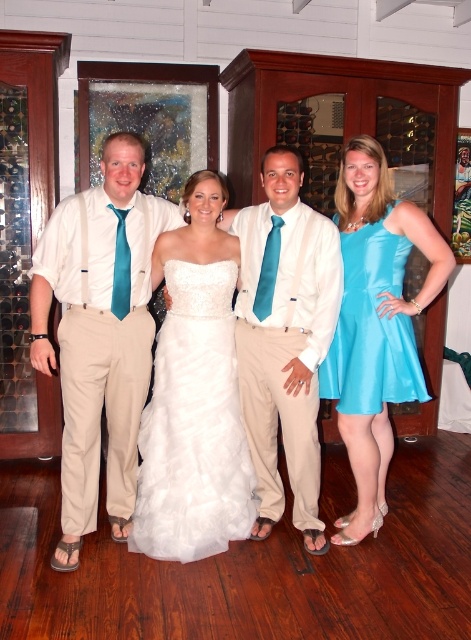
Question: Which of the following is the farthest from the observer?

Choices:
 (A) (402, 346)
 (B) (126, 241)
 (C) (262, 253)

Answer: (C)

Question: Can you confirm if matte khaki pants at left is bigger than white satin dress at center?

Choices:
 (A) no
 (B) yes

Answer: (B)

Question: Which is farther from the matte white shirt at center?

Choices:
 (A) turquoise satin dress at center
 (B) teal satin tie at center
 (C) teal satin tie at left

Answer: (C)

Question: Is teal satin tie at left bigger than teal satin tie at center?

Choices:
 (A) no
 (B) yes

Answer: (A)

Question: Which is farther from the teal satin tie at left?

Choices:
 (A) matte khaki pants at left
 (B) matte white shirt at center
 (C) turquoise satin dress at right

Answer: (C)

Question: Can you confirm if matte white shirt at center is bigger than teal satin tie at center?

Choices:
 (A) yes
 (B) no

Answer: (A)